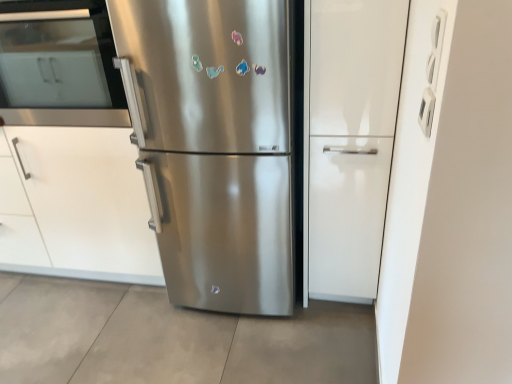
Question: Is white matte cabinet at left placed right next to white glossy cabinet at center?

Choices:
 (A) yes
 (B) no

Answer: (B)

Question: Is white matte cabinet at left not near white glossy cabinet at center?

Choices:
 (A) no
 (B) yes

Answer: (B)

Question: From a real-world perspective, is white matte cabinet at left on top of white glossy cabinet at center?

Choices:
 (A) yes
 (B) no

Answer: (B)

Question: From the image's perspective, is white matte cabinet at left above white glossy cabinet at center?

Choices:
 (A) yes
 (B) no

Answer: (B)

Question: Is white matte cabinet at left thinner than white glossy cabinet at center?

Choices:
 (A) yes
 (B) no

Answer: (B)

Question: Is white matte cabinet at left wider than white glossy cabinet at center?

Choices:
 (A) yes
 (B) no

Answer: (A)

Question: Is white glossy cabinet at center oriented towards stainless steel oven at left?

Choices:
 (A) yes
 (B) no

Answer: (B)

Question: Considering the relative sizes of white glossy cabinet at center and stainless steel oven at left in the image provided, is white glossy cabinet at center taller than stainless steel oven at left?

Choices:
 (A) no
 (B) yes

Answer: (B)

Question: Is white glossy cabinet at center not inside stainless steel oven at left?

Choices:
 (A) no
 (B) yes

Answer: (B)

Question: From a real-world perspective, is white glossy cabinet at center physically below stainless steel oven at left?

Choices:
 (A) yes
 (B) no

Answer: (A)

Question: Considering the relative sizes of white glossy cabinet at center and stainless steel oven at left in the image provided, is white glossy cabinet at center shorter than stainless steel oven at left?

Choices:
 (A) yes
 (B) no

Answer: (B)

Question: Is white glossy cabinet at center smaller than stainless steel oven at left?

Choices:
 (A) yes
 (B) no

Answer: (B)

Question: Is white glossy cabinet at center touching white matte cabinet at left?

Choices:
 (A) yes
 (B) no

Answer: (B)